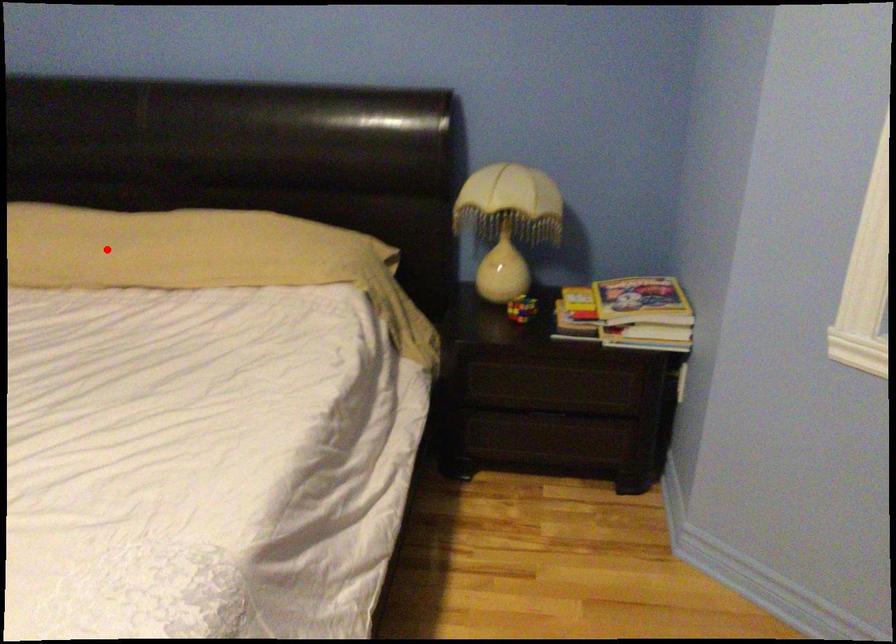
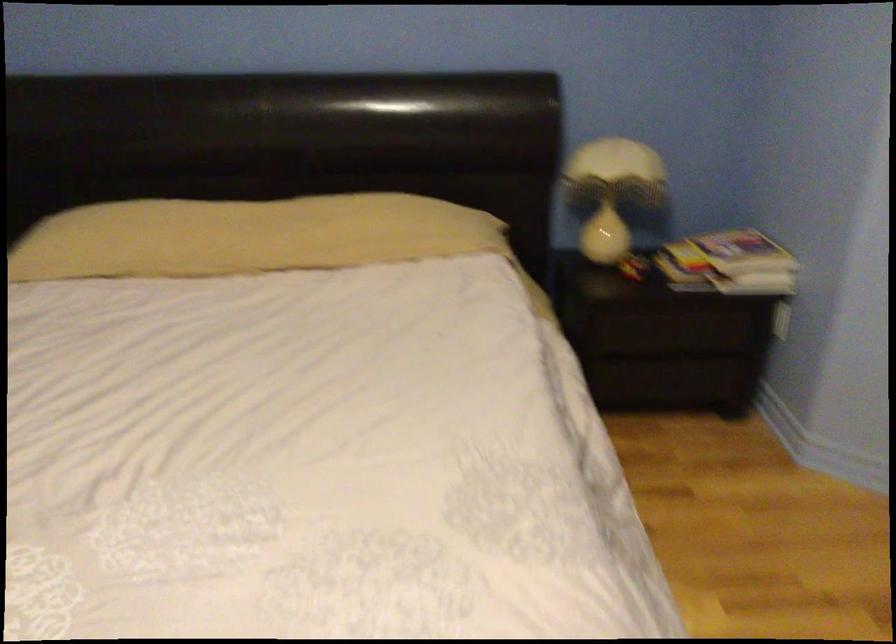
Where in the second image is the point corresponding to the highlighted location from the first image?

(247, 236)